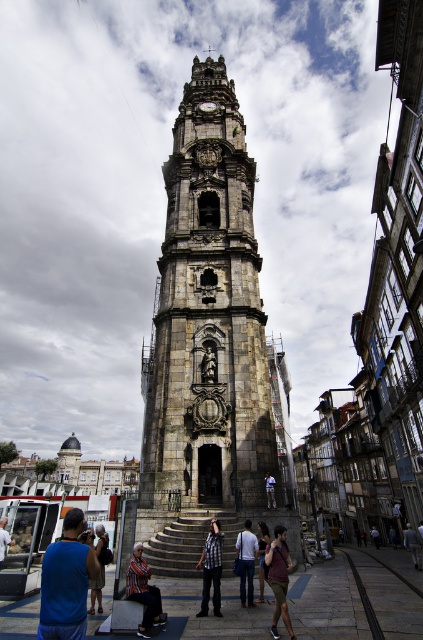
You are a tourist standing at the base of the stone clock tower at center and want to take a photo of yourself with the tower in the background. However, there is a person wearing a blue fabric shirt at lower left blocking your view. Based on their positions, can you move to the left or right to avoid them while keeping the tower in frame?

The stone clock tower at center is positioned on the right side of blue fabric shirt at lower left. To avoid the person while keeping the tower in frame, you should move to the left side of the blue fabric shirt at lower left so the tower remains on your right in the background.

You are a tourist standing at the base of the historic stone tower. You notice two people wearing a blue fabric shirt at lower left and a white cotton shirt at center. Which person is positioned more to the left side of the tower?

The blue fabric shirt at lower left is positioned more to the left side of the tower than the white cotton shirt at center.